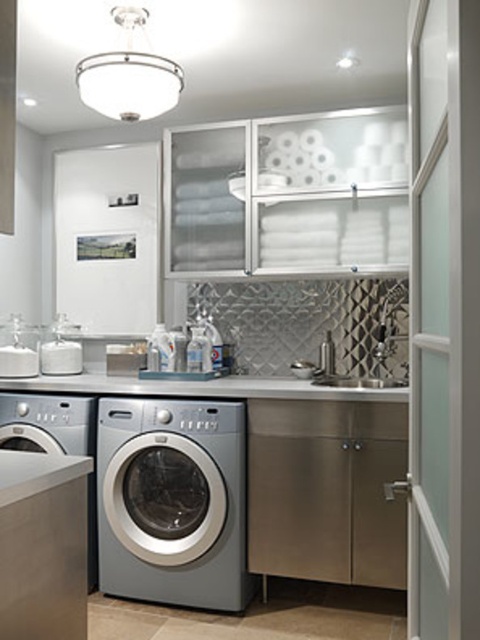
You need to place a large laundry basket on the counter. Based on the image, can the white glossy countertop at center accommodate the basket if the basket is wider than the satin nickel sink at center?

The white glossy countertop at center might be wider than the satin nickel sink at center, so if the basket is wider than the sink, it could potentially fit on the countertop.

You are organizing the laundry room and need to place a new laundry basket that requires 1.2 square meters of space. Given the satin silver washer at center and the white glossy countertop at center, which one has enough space to accommodate the basket?

The white glossy countertop at center has enough space to accommodate the laundry basket since it occupies more space than the satin silver washer at center.

You are standing in the laundry room and need to reach both the point at (158, 580) and the point at (193, 385). Which point should you reach first to follow the shortest path?

You should reach point (158, 580) first because it is in front of point (193, 385), so it is closer to you.